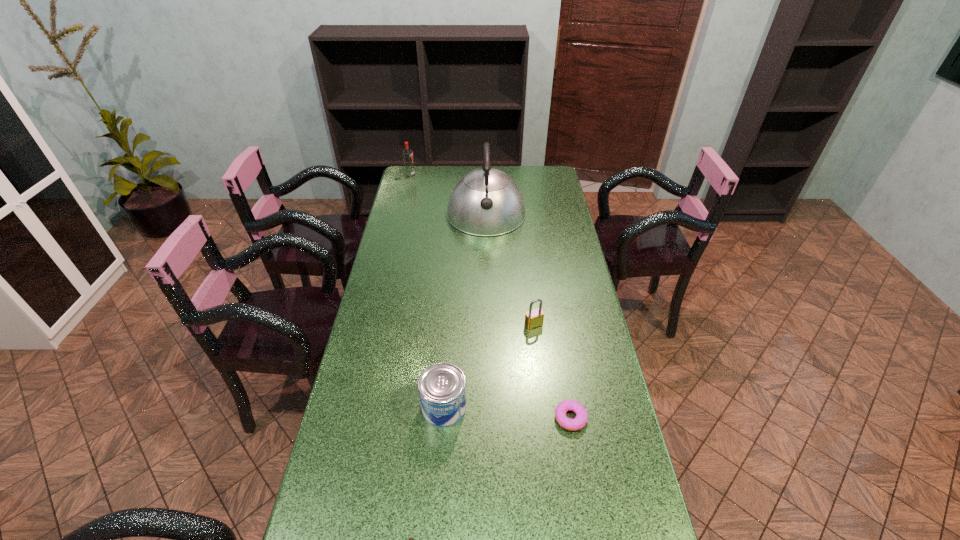
Where is `unoccupied position between the can and the tallest object`? The image size is (960, 540). unoccupied position between the can and the tallest object is located at coordinates (465, 311).

At what (x,y) coordinates should I click in order to perform the action: click on free area in between the third farthest object and the doughnut. Please return your answer as a coordinate pair (x, y). Looking at the image, I should click on coord(552,371).

Locate an element on the screen. vacant space that's between the tallest object and the third farthest object is located at coordinates (510, 269).

This screenshot has height=540, width=960. Identify the location of blank region between the can and the tallest object. tap(465, 311).

Where is `the closest object relative to the farthest object`? The height and width of the screenshot is (540, 960). the closest object relative to the farthest object is located at coordinates (485, 202).

This screenshot has width=960, height=540. What are the coordinates of `object that stands as the closest to the leftmost object` in the screenshot? It's located at (485, 202).

Identify the location of free region that satisfies the following two spatial constraints: 1. on the front label of the can; 2. on the left side of the doughnut. The width and height of the screenshot is (960, 540). (444, 418).

Locate an element on the screen. Image resolution: width=960 pixels, height=540 pixels. free point that satisfies the following two spatial constraints: 1. on the back side of the doughnut; 2. on the front label of the can is located at coordinates (568, 408).

You are a GUI agent. You are given a task and a screenshot of the screen. Output one action in this format:
    pyautogui.click(x=<x>, y=<y>)
    Task: Click on the free location that satisfies the following two spatial constraints: 1. on the front label of the padlock; 2. on the left side of the farthest object
    
    Given the screenshot: What is the action you would take?
    pyautogui.click(x=374, y=325)

Locate an element on the screen. vacant space that satisfies the following two spatial constraints: 1. on the front label of the can; 2. on the right side of the shortest object is located at coordinates (444, 418).